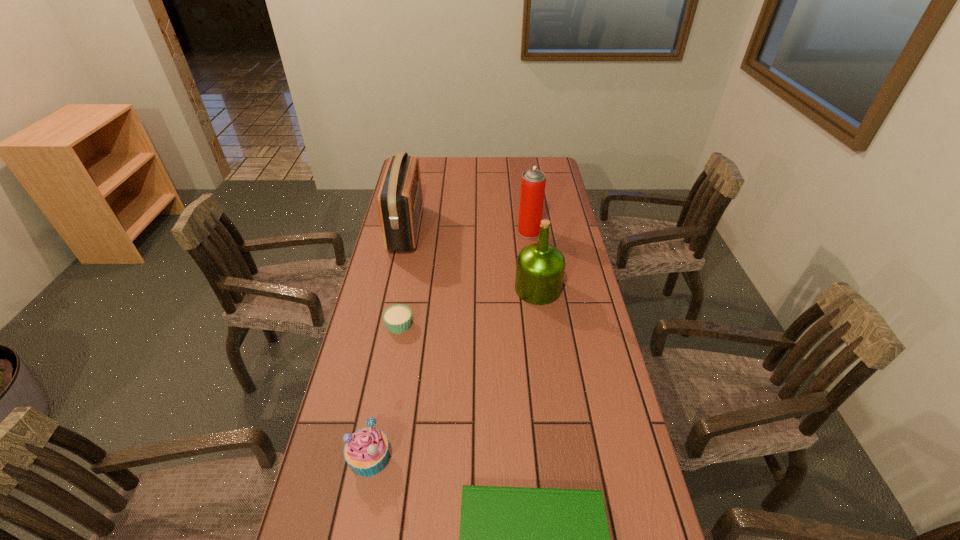
Locate an element on the screen. vacant area that lies between the muffin and the radio receiver is located at coordinates 388,344.

The width and height of the screenshot is (960, 540). What are the coordinates of `vacant space in between the muffin and the radio receiver` in the screenshot? It's located at (388, 344).

Locate an element on the screen. This screenshot has height=540, width=960. vacant region between the radio receiver and the fifth farthest object is located at coordinates (388, 344).

Where is `unoccupied position between the radio receiver and the third nearest object`? Image resolution: width=960 pixels, height=540 pixels. unoccupied position between the radio receiver and the third nearest object is located at coordinates (402, 277).

Find the location of a particular element. The height and width of the screenshot is (540, 960). free space between the aerosol can and the radio receiver is located at coordinates (468, 230).

Where is `free point between the fourth farthest object and the olive oil`? Image resolution: width=960 pixels, height=540 pixels. free point between the fourth farthest object and the olive oil is located at coordinates click(468, 307).

Select which object is the closest to the olive oil. Please provide its 2D coordinates. Your answer should be formatted as a tuple, i.e. [(x, y)], where the tuple contains the x and y coordinates of a point satisfying the conditions above.

[(533, 181)]

In order to click on object that ranks as the closest to the shortest object in this screenshot , I will do `click(366, 450)`.

This screenshot has height=540, width=960. In order to click on free space that satisfies the following two spatial constraints: 1. on the front-facing side of the aerosol can; 2. on the left side of the radio receiver in this screenshot , I will do `click(406, 232)`.

Locate an element on the screen. The height and width of the screenshot is (540, 960). free point that satisfies the following two spatial constraints: 1. on the front-facing side of the radio receiver; 2. on the back side of the aerosol can is located at coordinates (406, 232).